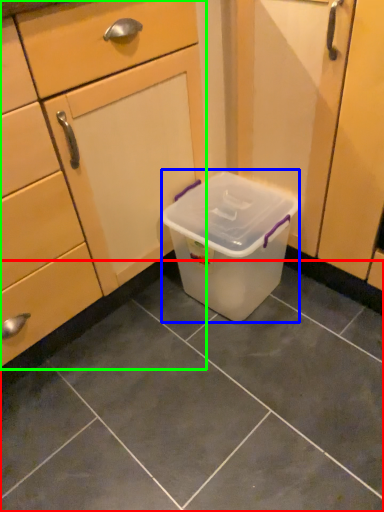
Question: Based on their relative distances, which object is nearer to tile (highlighted by a red box)? Choose from storage box (highlighted by a blue box) and cabinetry (highlighted by a green box).

Choices:
 (A) storage box
 (B) cabinetry

Answer: (A)